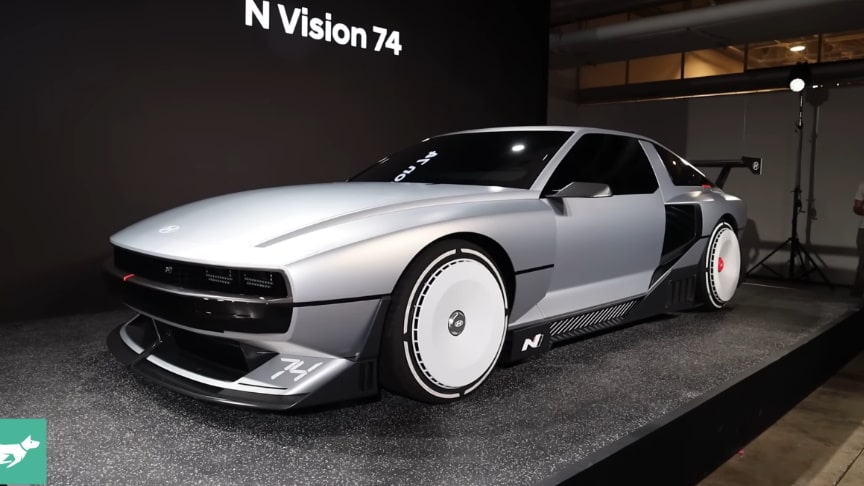
Where is `grey spotted floor`? This screenshot has height=486, width=864. grey spotted floor is located at coordinates (92, 428).